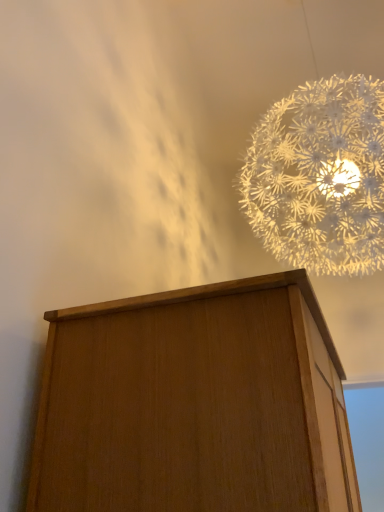
Image resolution: width=384 pixels, height=512 pixels. What do you see at coordinates (320, 177) in the screenshot?
I see `white paper-like at upper right` at bounding box center [320, 177].

The height and width of the screenshot is (512, 384). In order to click on white paper-like at upper right in this screenshot , I will do `click(320, 177)`.

Find the location of `white paper-like at upper right`. white paper-like at upper right is located at coordinates (320, 177).